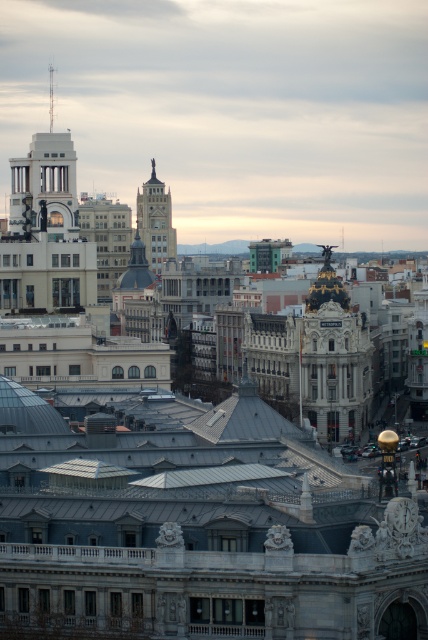
Between matte gray tower at center and smooth silver spire at upper left, which one is positioned lower?

matte gray tower at center is below.

How far apart are matte gray tower at center and smooth silver spire at upper left?

A distance of 36.33 meters exists between matte gray tower at center and smooth silver spire at upper left.

The height and width of the screenshot is (640, 428). What do you see at coordinates (155, 221) in the screenshot?
I see `matte gray tower at center` at bounding box center [155, 221].

Where is `matte gray tower at center`? The height and width of the screenshot is (640, 428). matte gray tower at center is located at coordinates (155, 221).